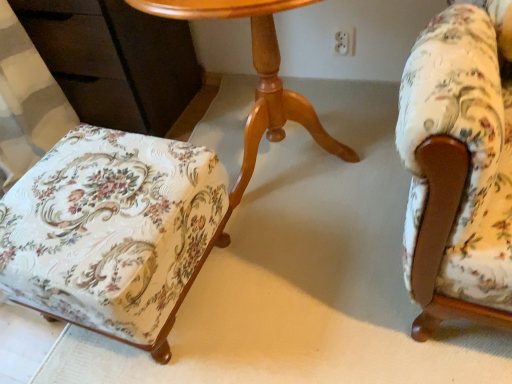
Image resolution: width=512 pixels, height=384 pixels. What do you see at coordinates (110, 229) in the screenshot?
I see `floral fabric ottoman at lower left, which is the 1th chair from left to right` at bounding box center [110, 229].

Where is `floral fabric armchair at right, arranged as the first chair when viewed from the right`? The width and height of the screenshot is (512, 384). floral fabric armchair at right, arranged as the first chair when viewed from the right is located at coordinates (459, 167).

At what (x,y) coordinates should I click in order to perform the action: click on floral fabric ottoman at lower left, which is the 1th chair from left to right. Please return your answer as a coordinate pair (x, y). Looking at the image, I should click on (110, 229).

Does floral fabric ottoman at lower left, which is the 1th chair from left to right, come behind floral fabric armchair at right, acting as the 2th chair starting from the left?

Yes.

What are the coordinates of `chair above the floral fabric ottoman at lower left, the second chair in the right-to-left sequence (from a real-world perspective)` in the screenshot? It's located at (459, 167).

Is floral fabric ottoman at lower left, which is the 1th chair from left to right, not close to floral fabric armchair at right, acting as the 2th chair starting from the left?

They are positioned close to each other.

From a real-world perspective, is floral fabric ottoman at lower left, the second chair in the right-to-left sequence, above or below light brown wood table at center?

Clearly, from a real-world perspective, floral fabric ottoman at lower left, the second chair in the right-to-left sequence, is below light brown wood table at center.

Based on their sizes in the image, would you say floral fabric ottoman at lower left, which is the 1th chair from left to right, is bigger or smaller than light brown wood table at center?

Considering their sizes, floral fabric ottoman at lower left, which is the 1th chair from left to right, takes up less space than light brown wood table at center.

Would you consider floral fabric ottoman at lower left, the second chair in the right-to-left sequence, to be distant from light brown wood table at center?

No, floral fabric ottoman at lower left, the second chair in the right-to-left sequence, is in close proximity to light brown wood table at center.

From the image's perspective, between floral fabric ottoman at lower left, the second chair in the right-to-left sequence, and light brown wood table at center, who is located below?

floral fabric ottoman at lower left, the second chair in the right-to-left sequence, from the image's perspective.

Which is behind, light brown wood table at center or floral fabric ottoman at lower left, which is the 1th chair from left to right?

floral fabric ottoman at lower left, which is the 1th chair from left to right, is more distant.

From the picture: Are light brown wood table at center and floral fabric ottoman at lower left, the second chair in the right-to-left sequence, beside each other?

No, light brown wood table at center is not in contact with floral fabric ottoman at lower left, the second chair in the right-to-left sequence.

Identify the location of table on the right of floral fabric ottoman at lower left, which is the 1th chair from left to right. The height and width of the screenshot is (384, 512). (258, 75).

Is floral fabric ottoman at lower left, which is the 1th chair from left to right, inside floral fabric armchair at right, arranged as the first chair when viewed from the right?

No, floral fabric armchair at right, arranged as the first chair when viewed from the right, does not contain floral fabric ottoman at lower left, which is the 1th chair from left to right.

Is the surface of floral fabric armchair at right, acting as the 2th chair starting from the left, in direct contact with floral fabric ottoman at lower left, the second chair in the right-to-left sequence?

floral fabric armchair at right, acting as the 2th chair starting from the left, and floral fabric ottoman at lower left, the second chair in the right-to-left sequence, are not in contact.

Between floral fabric armchair at right, arranged as the first chair when viewed from the right, and floral fabric ottoman at lower left, the second chair in the right-to-left sequence, which one is positioned behind?

A: floral fabric ottoman at lower left, the second chair in the right-to-left sequence, is behind.

Can you confirm if floral fabric armchair at right, arranged as the first chair when viewed from the right, is thinner than floral fabric ottoman at lower left, which is the 1th chair from left to right?

Incorrect, the width of floral fabric armchair at right, arranged as the first chair when viewed from the right, is not less than that of floral fabric ottoman at lower left, which is the 1th chair from left to right.

Which of these two, light brown wood table at center or floral fabric armchair at right, acting as the 2th chair starting from the left, is bigger?

With larger size is light brown wood table at center.

Between point (273, 3) and point (486, 280), which one is positioned behind?

Point (273, 3)

Where is `table on the left of floral fabric armchair at right, arranged as the first chair when viewed from the right`? The image size is (512, 384). table on the left of floral fabric armchair at right, arranged as the first chair when viewed from the right is located at coordinates (258, 75).

From a real-world perspective, is light brown wood table at center under floral fabric armchair at right, arranged as the first chair when viewed from the right?

Yes.

Considering the relative positions of floral fabric armchair at right, acting as the 2th chair starting from the left, and light brown wood table at center in the image provided, is floral fabric armchair at right, acting as the 2th chair starting from the left, to the left of light brown wood table at center from the viewer's perspective?

In fact, floral fabric armchair at right, acting as the 2th chair starting from the left, is to the right of light brown wood table at center.

From the image's perspective, is floral fabric armchair at right, arranged as the first chair when viewed from the right, located above or below light brown wood table at center?

Based on their image positions, floral fabric armchair at right, arranged as the first chair when viewed from the right, is located beneath light brown wood table at center.

Measure the distance from floral fabric armchair at right, acting as the 2th chair starting from the left, to light brown wood table at center.

floral fabric armchair at right, acting as the 2th chair starting from the left, and light brown wood table at center are 15.98 inches apart from each other.

Is light brown wood table at center surrounded by floral fabric armchair at right, acting as the 2th chair starting from the left?

Definitely not — light brown wood table at center is not inside floral fabric armchair at right, acting as the 2th chair starting from the left.

Locate an element on the screen. The height and width of the screenshot is (384, 512). chair that is above the floral fabric ottoman at lower left, which is the 1th chair from left to right (from the image's perspective) is located at coordinates (459, 167).

Where is `chair on the left of the light brown wood table at center`? chair on the left of the light brown wood table at center is located at coordinates (110, 229).

Based on their spatial positions, is light brown wood table at center or floral fabric ottoman at lower left, which is the 1th chair from left to right, closer to floral fabric armchair at right, acting as the 2th chair starting from the left?

light brown wood table at center is closer to floral fabric armchair at right, acting as the 2th chair starting from the left.

Based on their spatial positions, is floral fabric armchair at right, arranged as the first chair when viewed from the right, or light brown wood table at center further from floral fabric ottoman at lower left, which is the 1th chair from left to right?

floral fabric armchair at right, arranged as the first chair when viewed from the right.

Estimate the real-world distances between objects in this image. Which object is further from floral fabric armchair at right, arranged as the first chair when viewed from the right, floral fabric ottoman at lower left, the second chair in the right-to-left sequence, or light brown wood table at center?

The object further to floral fabric armchair at right, arranged as the first chair when viewed from the right, is floral fabric ottoman at lower left, the second chair in the right-to-left sequence.

When comparing their distances from light brown wood table at center, does floral fabric ottoman at lower left, which is the 1th chair from left to right, or floral fabric armchair at right, acting as the 2th chair starting from the left, seem further?

The object further to light brown wood table at center is floral fabric armchair at right, acting as the 2th chair starting from the left.

Consider the image. Estimate the real-world distances between objects in this image. Which object is closer to light brown wood table at center, floral fabric armchair at right, acting as the 2th chair starting from the left, or floral fabric ottoman at lower left, which is the 1th chair from left to right?

floral fabric ottoman at lower left, which is the 1th chair from left to right, is positioned closer to the anchor light brown wood table at center.

From the image, which object appears to be farther from floral fabric ottoman at lower left, the second chair in the right-to-left sequence, light brown wood table at center or floral fabric armchair at right, acting as the 2th chair starting from the left?

floral fabric armchair at right, acting as the 2th chair starting from the left.

This screenshot has width=512, height=384. Find the location of `table situated between floral fabric ottoman at lower left, the second chair in the right-to-left sequence, and floral fabric armchair at right, arranged as the first chair when viewed from the right, from left to right`. table situated between floral fabric ottoman at lower left, the second chair in the right-to-left sequence, and floral fabric armchair at right, arranged as the first chair when viewed from the right, from left to right is located at coordinates (258, 75).